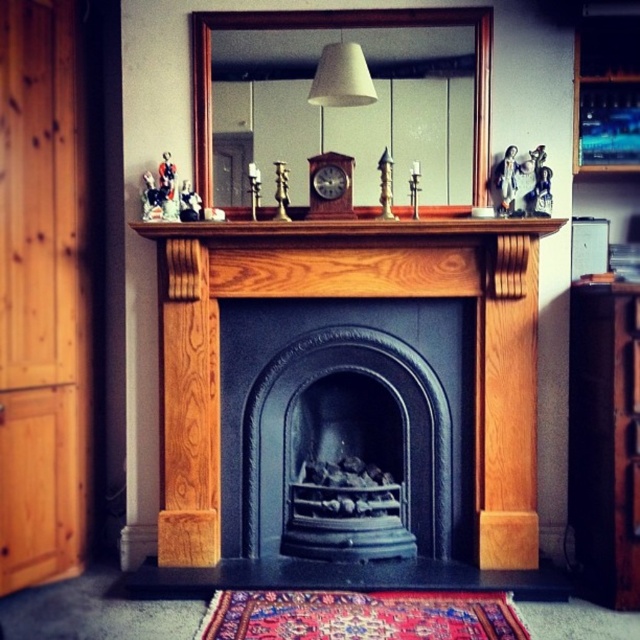
You are standing in the room and want to place a new painting on the wall. The painting is 1 meter wide. The wooden armoire at left is located at point 0.463, 0.069. Can you hang the painting on the wall without overlapping the armoire?

The wooden armoire at left is located at point (44, 296). To determine if the painting can be hung without overlapping, you need to know the dimensions of the wall and the size of the armoire. Since this information isn not provided, it is not possible to confirm if the painting will fit without overlapping.

You are an interior designer planning to hang a new picture frame. You see the wooden mantelpiece at center and the matte white lampshade at upper center. Which object is located lower in the image?

The wooden mantelpiece at center is located lower than the matte white lampshade at upper center.

You are standing in front of the fireplace mantel and want to take a photo of the point at coordinates point (26, 342). If your camera is set to a focal length that requires the subject to be at least 10 feet away for clear focus, will the photo be blurry?

The point point (26, 342) is 9.17 feet away from the camera, which is less than the required 10 feet for clear focus. Therefore, the photo will likely be blurry.